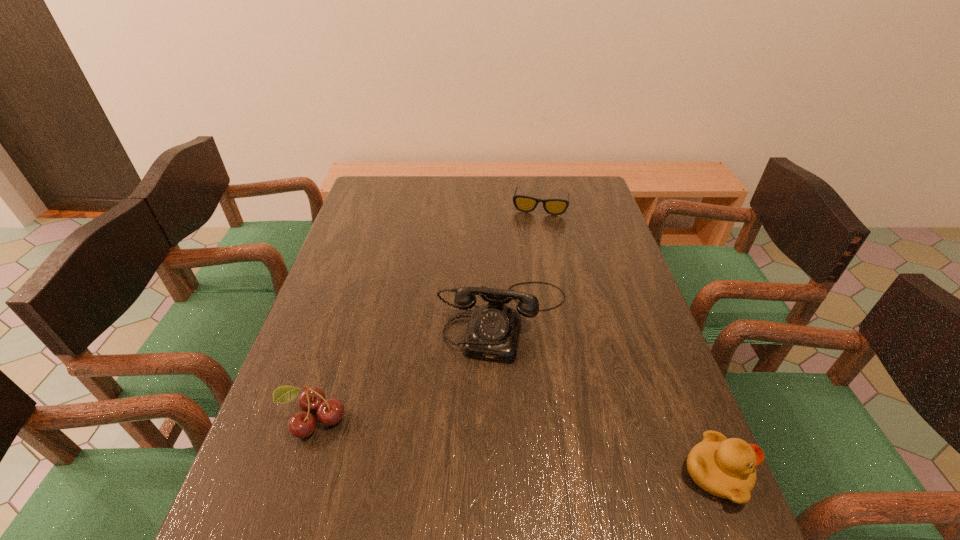
I want to click on cherry, so click(x=302, y=424).

I want to click on the rightmost object, so click(x=725, y=468).

The height and width of the screenshot is (540, 960). In order to click on the second farthest object in this screenshot , I will do `click(493, 332)`.

Where is `sunglasses`? sunglasses is located at coordinates (522, 203).

Locate an element on the screen. The height and width of the screenshot is (540, 960). the shortest object is located at coordinates coord(522,203).

Find the location of a particular element. This screenshot has height=540, width=960. free point located on the leaves of the leftmost object is located at coordinates (296, 478).

Identify the location of vacant space situated on the front-facing side of the third nearest object. (483, 423).

At what (x,y) coordinates should I click in order to perform the action: click on vacant space located 0.090m on the front-facing side of the third nearest object. Please return your answer as a coordinate pair (x, y). Looking at the image, I should click on (489, 395).

Locate an element on the screen. free spot located 0.230m on the front-facing side of the third nearest object is located at coordinates (477, 454).

This screenshot has width=960, height=540. Find the location of `vacant position located on the front-facing side of the shortest object`. vacant position located on the front-facing side of the shortest object is located at coordinates (535, 230).